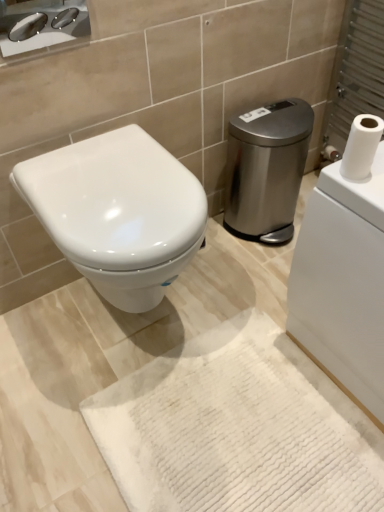
Question: From the image's perspective, is satin silver trash can at center right below white matte toilet paper at upper right?

Choices:
 (A) no
 (B) yes

Answer: (A)

Question: From a real-world perspective, is satin silver trash can at center right physically below white matte toilet paper at upper right?

Choices:
 (A) yes
 (B) no

Answer: (A)

Question: Is satin silver trash can at center right next to white matte toilet paper at upper right?

Choices:
 (A) no
 (B) yes

Answer: (A)

Question: Does satin silver trash can at center right appear on the left side of white matte toilet paper at upper right?

Choices:
 (A) no
 (B) yes

Answer: (B)

Question: Can you confirm if satin silver trash can at center right is taller than white matte toilet paper at upper right?

Choices:
 (A) yes
 (B) no

Answer: (A)

Question: Visually, is polished chrome sink at upper left positioned to the left or to the right of white textured bath mat at center?

Choices:
 (A) left
 (B) right

Answer: (A)

Question: Considering the positions of point (1, 46) and point (218, 446), is point (1, 46) closer or farther from the camera than point (218, 446)?

Choices:
 (A) closer
 (B) farther

Answer: (A)

Question: Looking at their shapes, would you say polished chrome sink at upper left is wider or thinner than white textured bath mat at center?

Choices:
 (A) thin
 (B) wide

Answer: (A)

Question: From the image's perspective, is polished chrome sink at upper left positioned above or below white textured bath mat at center?

Choices:
 (A) below
 (B) above

Answer: (B)

Question: In terms of height, does white glossy toilet at center look taller or shorter compared to polished chrome sink at upper left?

Choices:
 (A) tall
 (B) short

Answer: (A)

Question: Relative to polished chrome sink at upper left, is white glossy toilet at center in front or behind?

Choices:
 (A) behind
 (B) front

Answer: (B)

Question: Choose the correct answer: Is white glossy toilet at center inside polished chrome sink at upper left or outside it?

Choices:
 (A) inside
 (B) outside

Answer: (B)

Question: Looking at their shapes, would you say white glossy toilet at center is wider or thinner than polished chrome sink at upper left?

Choices:
 (A) wide
 (B) thin

Answer: (A)

Question: Is white textured bath mat at center inside the boundaries of white glossy toilet at center, or outside?

Choices:
 (A) inside
 (B) outside

Answer: (B)

Question: Is white textured bath mat at center wider or thinner than white glossy toilet at center?

Choices:
 (A) thin
 (B) wide

Answer: (B)